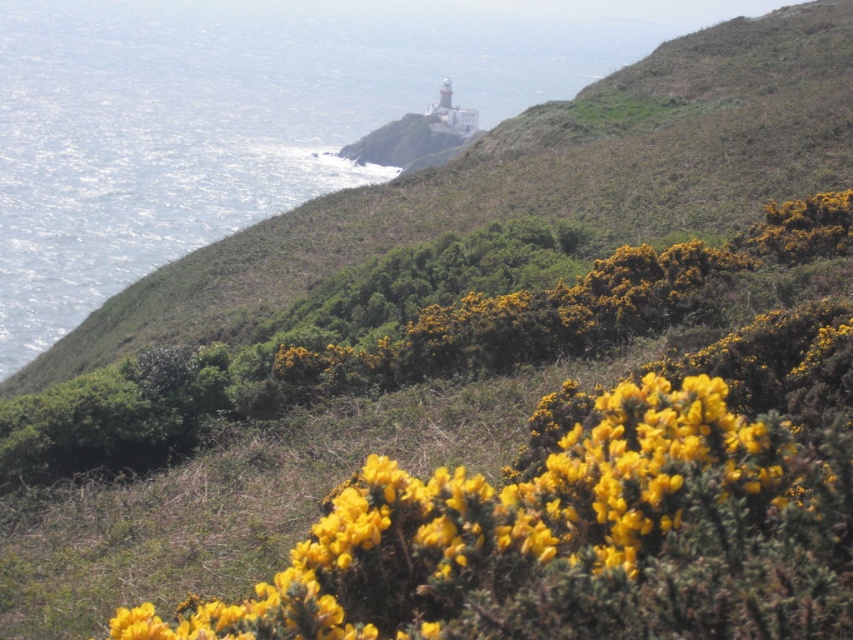
You are a photographer planning to capture the clear blue water at upper left in your shot. Based on its coordinates, where exactly should you position your camera to ensure it is centered in the frame?

The clear blue water at upper left is located at point coordinates (244, 116). To center it in your frame, position your camera so that the center of the viewfinder aligns with these coordinates.

In the scene shown: You are a photographer planning to capture the clear blue water at upper left and the yellow fuzzy bush at lower center in a single shot. Based on the scene, which object appears taller in the photograph?

The clear blue water at upper left appears taller than the yellow fuzzy bush at lower center in the photograph.